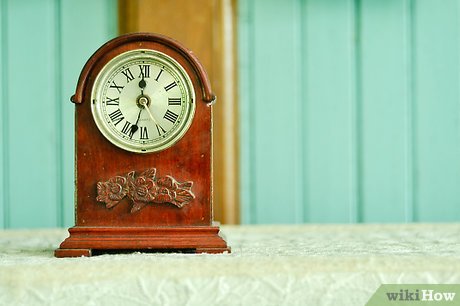
Image resolution: width=460 pixels, height=306 pixels. Find the location of `clock face`. clock face is located at coordinates (162, 97).